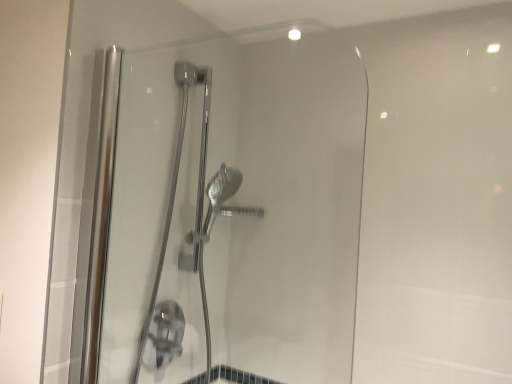
Question: From the image's perspective, is clear glass shower door at center, positioned as the first shower door in front-to-back order, beneath chrome metallic shower door at center, which is the 1th shower door in back-to-front order?

Choices:
 (A) no
 (B) yes

Answer: (A)

Question: Does clear glass shower door at center, the second shower door in the back-to-front sequence, have a larger size compared to chrome metallic shower door at center, the 2th shower door viewed from the front?

Choices:
 (A) no
 (B) yes

Answer: (A)

Question: From a real-world perspective, is clear glass shower door at center, positioned as the first shower door in front-to-back order, under chrome metallic shower door at center, the 2th shower door viewed from the front?

Choices:
 (A) no
 (B) yes

Answer: (A)

Question: Is clear glass shower door at center, the second shower door in the back-to-front sequence, smaller than chrome metallic shower door at center, the 2th shower door viewed from the front?

Choices:
 (A) yes
 (B) no

Answer: (A)

Question: Can you confirm if clear glass shower door at center, positioned as the first shower door in front-to-back order, is shorter than chrome metallic shower door at center, the 2th shower door viewed from the front?

Choices:
 (A) yes
 (B) no

Answer: (A)

Question: From a real-world perspective, is clear glass shower door at center, positioned as the first shower door in front-to-back order, located higher than chrome metallic shower door at center, which is the 1th shower door in back-to-front order?

Choices:
 (A) no
 (B) yes

Answer: (B)

Question: Is chrome metallic shower door at center, the 2th shower door viewed from the front, not within clear glass shower door at center, positioned as the first shower door in front-to-back order?

Choices:
 (A) yes
 (B) no

Answer: (A)

Question: Is chrome metallic shower door at center, the 2th shower door viewed from the front, beside clear glass shower door at center, the second shower door in the back-to-front sequence?

Choices:
 (A) yes
 (B) no

Answer: (B)

Question: Does chrome metallic shower door at center, the 2th shower door viewed from the front, have a greater width compared to clear glass shower door at center, the second shower door in the back-to-front sequence?

Choices:
 (A) yes
 (B) no

Answer: (A)

Question: From a real-world perspective, does chrome metallic shower door at center, the 2th shower door viewed from the front, stand above clear glass shower door at center, the second shower door in the back-to-front sequence?

Choices:
 (A) no
 (B) yes

Answer: (A)

Question: Can you confirm if chrome metallic shower door at center, the 2th shower door viewed from the front, is taller than clear glass shower door at center, positioned as the first shower door in front-to-back order?

Choices:
 (A) yes
 (B) no

Answer: (A)

Question: Considering the relative positions of chrome metallic shower door at center, the 2th shower door viewed from the front, and clear glass shower door at center, positioned as the first shower door in front-to-back order, in the image provided, is chrome metallic shower door at center, the 2th shower door viewed from the front, behind clear glass shower door at center, positioned as the first shower door in front-to-back order,?

Choices:
 (A) no
 (B) yes

Answer: (B)

Question: Is chrome metallic shower door at center, which is the 1th shower door in back-to-front order, in front of or behind clear glass shower door at center, positioned as the first shower door in front-to-back order, in the image?

Choices:
 (A) behind
 (B) front

Answer: (A)